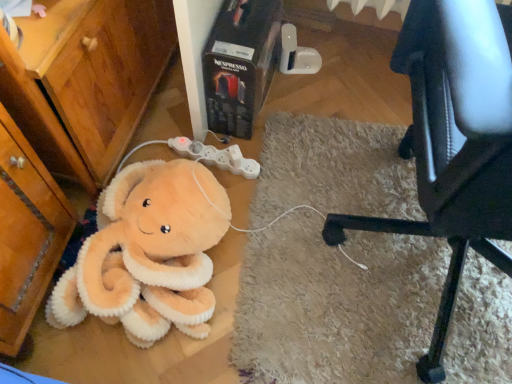
Find the location of a particular element. This screenshot has height=384, width=512. vacant space behind white plastic game controller at center is located at coordinates (217, 133).